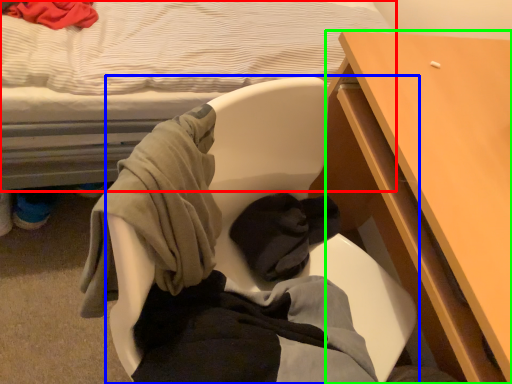
Question: Based on their relative distances, which object is farther from bed (highlighted by a red box)? Choose from chair (highlighted by a blue box) and desk (highlighted by a green box).

Choices:
 (A) chair
 (B) desk

Answer: (B)